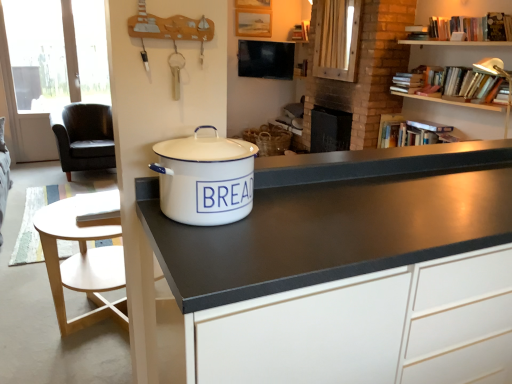
At what (x,y) coordinates should I click in order to perform the action: click on hardcover books at upper right. Please return your answer as a coordinate pair (x, y). Image resolution: width=512 pixels, height=384 pixels. Looking at the image, I should click on (472, 27).

What do you see at coordinates (83, 258) in the screenshot? I see `light wood round table at lower left` at bounding box center [83, 258].

This screenshot has height=384, width=512. Describe the element at coordinates (84, 137) in the screenshot. I see `black leather chair at left` at that location.

In order to face white enamel bread bin at center, should I rotate leftwards or rightwards?

A 6.358 degree turn to the left will do.

Find the location of `hardcover books at upper right`. hardcover books at upper right is located at coordinates (472, 27).

Could you tell me if hardcover books at upper right is turned towards white enamel bread bin at center?

No, hardcover books at upper right is not aimed at white enamel bread bin at center.

Considering the relative positions of hardcover books at upper right and white enamel bread bin at center in the image provided, is hardcover books at upper right to the right of white enamel bread bin at center from the viewer's perspective?

Correct, you'll find hardcover books at upper right to the right of white enamel bread bin at center.

From the image's perspective, is hardcover books at upper right on top of white enamel bread bin at center?

Indeed, from the image's perspective, hardcover books at upper right is shown above white enamel bread bin at center.

Who is more distant, white enamel bread bin at center or white matte cabinet at center?

white enamel bread bin at center is more distant.

From the image's perspective, is white enamel bread bin at center located beneath white matte cabinet at center?

No, from the image's perspective, white enamel bread bin at center is not below white matte cabinet at center.

At what (x,y) coordinates should I click in order to perform the action: click on cooker above the white matte cabinet at center (from a real-world perspective). Please return your answer as a coordinate pair (x, y). Looking at the image, I should click on (205, 179).

From a real-world perspective, is white enamel bread bin at center physically below white matte cabinet at center?

Incorrect, from a real-world perspective, white enamel bread bin at center is higher than white matte cabinet at center.

Measure the distance from hardcover books at upper right to white matte cabinet at center.

hardcover books at upper right and white matte cabinet at center are 2.37 meters apart from each other.

Does hardcover books at upper right have a greater height compared to white matte cabinet at center?

In fact, hardcover books at upper right may be shorter than white matte cabinet at center.

At what (x,y) coordinates should I click in order to perform the action: click on book that appears above the white matte cabinet at center (from the image's perspective). Please return your answer as a coordinate pair (x, y). This screenshot has width=512, height=384. Looking at the image, I should click on pyautogui.click(x=472, y=27).

Can we say hardcover books at upper right lies outside white matte cabinet at center?

hardcover books at upper right lies outside white matte cabinet at center's area.

Considering the positions of objects black leather chair at left and white matte cabinet at center in the image provided, who is more to the right, black leather chair at left or white matte cabinet at center?

white matte cabinet at center.

Considering the points (62, 150) and (241, 257), which point is behind, point (62, 150) or point (241, 257)?

The point (62, 150) is farther from the camera.

Which of these two, black leather chair at left or white matte cabinet at center, is thinner?

white matte cabinet at center.

From the image's perspective, is black leather chair at left positioned above or below white matte cabinet at center?

black leather chair at left is above white matte cabinet at center.

Considering the positions of objects black leather chair at left and hardcover books at upper right in the image provided, who is more to the left, black leather chair at left or hardcover books at upper right?

black leather chair at left.

Is the depth of black leather chair at left greater than that of hardcover books at upper right?

Yes.

Between point (67, 151) and point (477, 40), which one is positioned in front?

The point (477, 40) is closer to the camera.

Is black leather chair at left facing towards hardcover books at upper right?

No, black leather chair at left is not turned towards hardcover books at upper right.

Which of these two, light wood round table at lower left or white matte cabinet at center, is smaller?

light wood round table at lower left.

In order to click on cabinetry that appears in front of the light wood round table at lower left in this screenshot , I will do coord(352,270).

Is light wood round table at lower left oriented away from white matte cabinet at center?

light wood round table at lower left is not turned away from white matte cabinet at center.

In the image, there is a white enamel bread bin at center. Where is `table below it (from a real-world perspective)`? Image resolution: width=512 pixels, height=384 pixels. table below it (from a real-world perspective) is located at coordinates (83, 258).

From the picture: Can you confirm if light wood round table at lower left is wider than white enamel bread bin at center?

Indeed, light wood round table at lower left has a greater width compared to white enamel bread bin at center.

Considering the relative positions of light wood round table at lower left and white enamel bread bin at center in the image provided, is light wood round table at lower left to the left of white enamel bread bin at center from the viewer's perspective?

Indeed, light wood round table at lower left is positioned on the left side of white enamel bread bin at center.

From the image's perspective, is light wood round table at lower left above or below white enamel bread bin at center?

light wood round table at lower left is situated lower than white enamel bread bin at center in the image.

Find the location of a particular element. Image resolution: width=512 pixels, height=384 pixels. book that is above the white enamel bread bin at center (from the image's perspective) is located at coordinates tap(472, 27).

The height and width of the screenshot is (384, 512). In order to click on cooker above the white matte cabinet at center (from a real-world perspective) in this screenshot , I will do `click(205, 179)`.

Looking at this image, when comparing their distances from hardcover books at upper right, does light wood round table at lower left or black leather chair at left seem further?

black leather chair at left.

Looking at the image, which one is located further to black leather chair at left, hardcover books at upper right or white matte cabinet at center?

Based on the image, white matte cabinet at center appears to be further to black leather chair at left.

Estimate the real-world distances between objects in this image. Which object is closer to light wood round table at lower left, hardcover books at upper right or black leather chair at left?

Among the two, black leather chair at left is located nearer to light wood round table at lower left.

Which object lies nearer to the anchor point white enamel bread bin at center, light wood round table at lower left or hardcover books at upper right?

light wood round table at lower left is positioned closer to the anchor white enamel bread bin at center.

Based on their spatial positions, is black leather chair at left or white matte cabinet at center further from light wood round table at lower left?

black leather chair at left is positioned further to the anchor light wood round table at lower left.

When comparing their distances from light wood round table at lower left, does white enamel bread bin at center or white matte cabinet at center seem further?

white matte cabinet at center is further to light wood round table at lower left.

Estimate the real-world distances between objects in this image. Which object is further from hardcover books at upper right, white matte cabinet at center or black leather chair at left?

The object further to hardcover books at upper right is black leather chair at left.

Estimate the real-world distances between objects in this image. Which object is further from white enamel bread bin at center, black leather chair at left or white matte cabinet at center?

black leather chair at left.

At what (x,y) coordinates should I click in order to perform the action: click on table positioned between white enamel bread bin at center and black leather chair at left from near to far. Please return your answer as a coordinate pair (x, y). Image resolution: width=512 pixels, height=384 pixels. Looking at the image, I should click on (83, 258).

Find the location of `cooker between black leather chair at left and hardcover books at upper right`. cooker between black leather chair at left and hardcover books at upper right is located at coordinates (205, 179).

The width and height of the screenshot is (512, 384). I want to click on cooker between light wood round table at lower left and hardcover books at upper right from left to right, so click(x=205, y=179).

I want to click on cooker between white matte cabinet at center and black leather chair at left from front to back, so click(x=205, y=179).